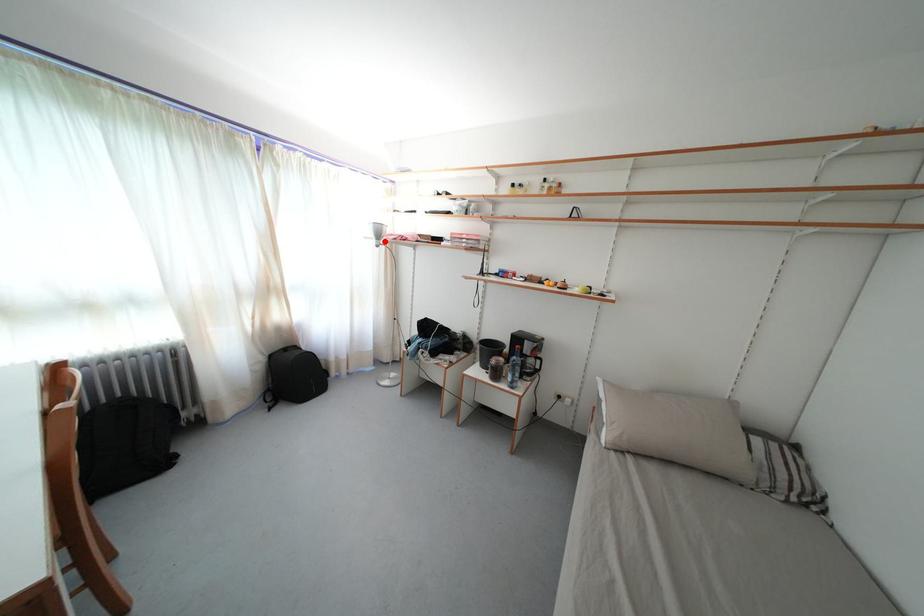
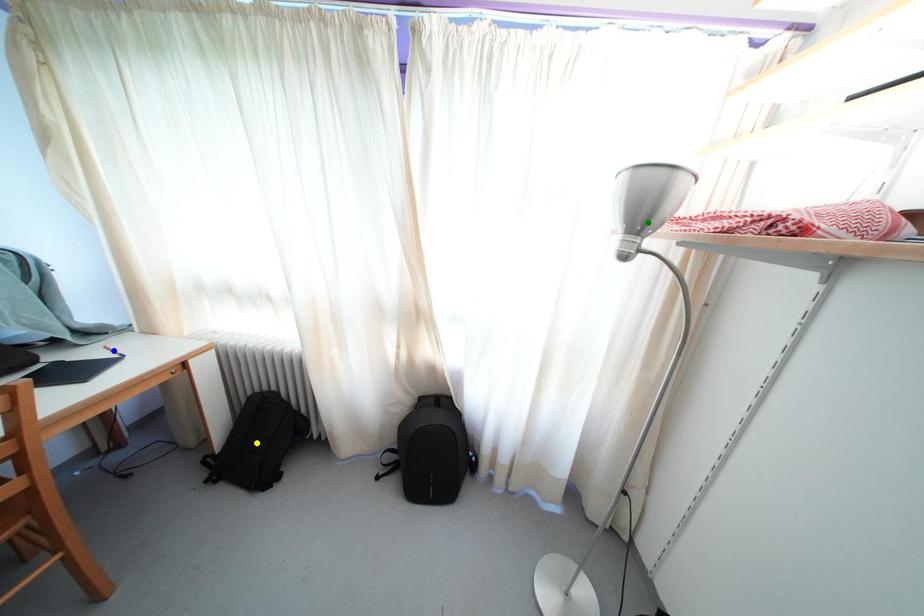
Question: I am providing you with two images of the same scene from different viewpoints. A red point is marked on the first image. You are given multiple points on the second image. Which spot in image 2 lines up with the point in image 1?

Choices:
 (A) yellow point
 (B) blue point
 (C) green point

Answer: (C)